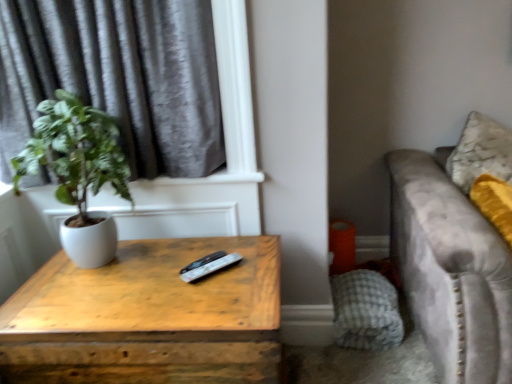
Identify the location of empty space that is in between white matte pot at left and black plastic remote at center. click(167, 262).